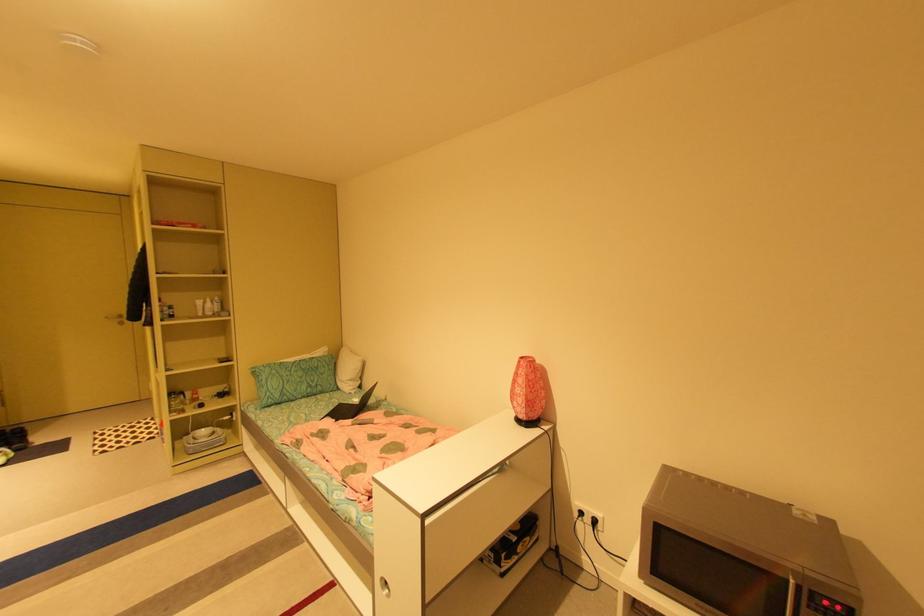
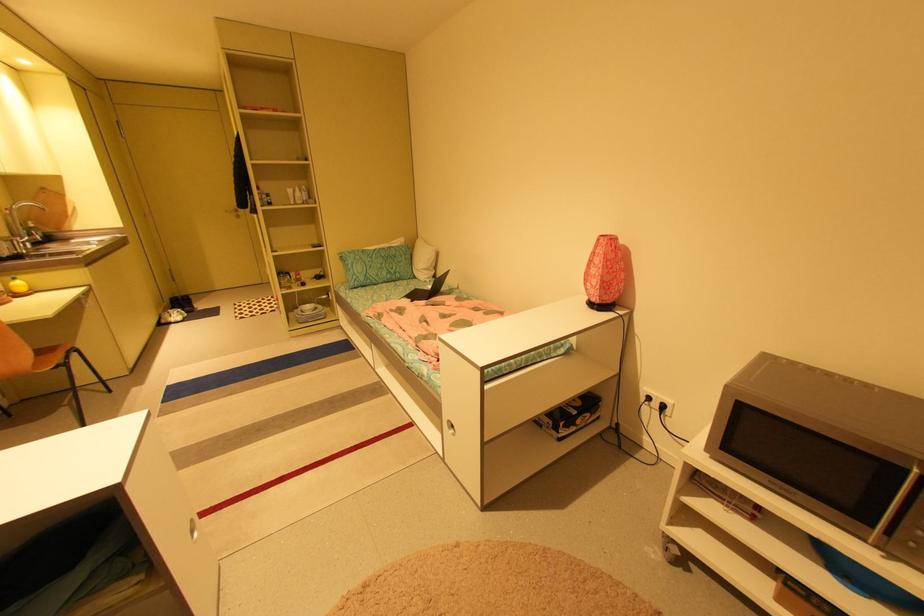
In the second image, find the point that corresponds to point 203,431 in the first image.

(310, 306)